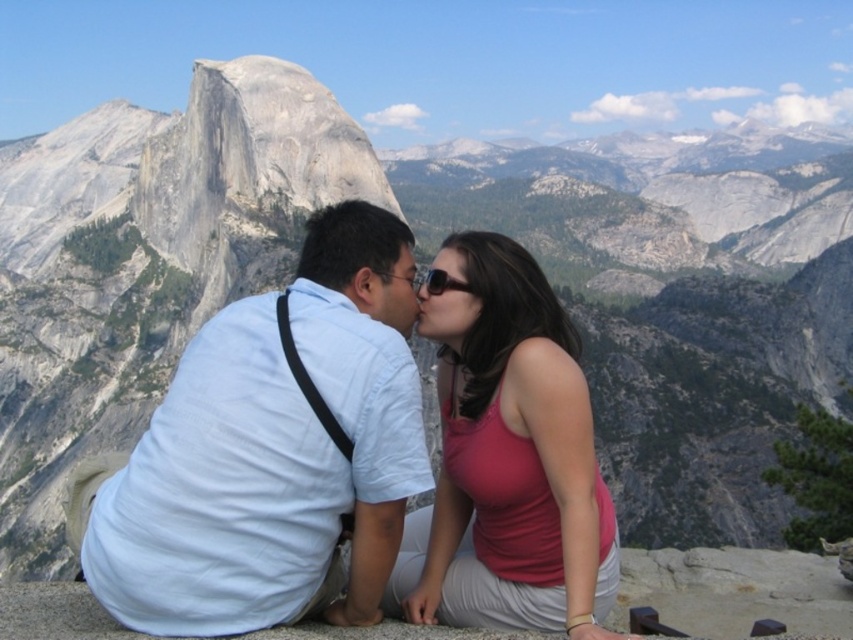
Question: Does matte pink tank top at center come behind matte black hair at center?

Choices:
 (A) yes
 (B) no

Answer: (B)

Question: Can you confirm if light blue cotton shirt at center is positioned above matte black hair at center?

Choices:
 (A) no
 (B) yes

Answer: (A)

Question: Which point is closer to the camera taking this photo?

Choices:
 (A) (540, 284)
 (B) (94, 541)

Answer: (B)

Question: Which of the following is the closest to the observer?

Choices:
 (A) light blue cotton shirt at center
 (B) matte black hair at center
 (C) matte pink tank top at center

Answer: (A)

Question: Is matte pink tank top at center below matte black hair at center?

Choices:
 (A) no
 (B) yes

Answer: (B)

Question: Which point is farther to the camera?

Choices:
 (A) matte pink tank top at center
 (B) light blue cotton shirt at center

Answer: (A)